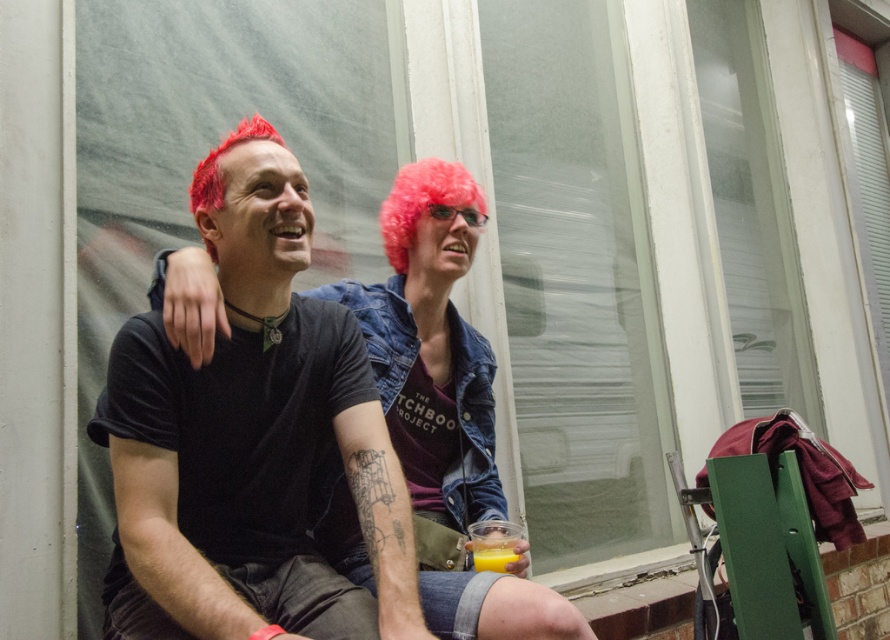
Which is more to the right, black matte t-shirt at center or translucent plastic cup at lower center?

translucent plastic cup at lower center is more to the right.

Does black matte t-shirt at center have a lesser height compared to translucent plastic cup at lower center?

No.

Does point (144, 476) lie in front of point (514, 560)?

Yes, point (144, 476) is closer to viewer.

At what (x,y) coordinates should I click in order to perform the action: click on black matte t-shirt at center. Please return your answer as a coordinate pair (x, y). Looking at the image, I should click on (247, 426).

Which is more to the left, black matte t-shirt at center or pink synthetic wig at upper center?

black matte t-shirt at center is more to the left.

Who is lower down, black matte t-shirt at center or pink synthetic wig at upper center?

black matte t-shirt at center is lower down.

Between point (392, 534) and point (425, 170), which one is positioned in front?

Point (392, 534) is more forward.

This screenshot has width=890, height=640. Identify the location of black matte t-shirt at center. (247, 426).

Image resolution: width=890 pixels, height=640 pixels. Find the location of `pink synthetic wig at upper center`. pink synthetic wig at upper center is located at coordinates (422, 202).

Is point (454, 193) behind point (507, 552)?

Yes, it is behind point (507, 552).

Does point (406, 253) come farther from viewer compared to point (490, 557)?

Yes, it is behind point (490, 557).

The image size is (890, 640). Find the location of `pink synthetic wig at upper center`. pink synthetic wig at upper center is located at coordinates (422, 202).